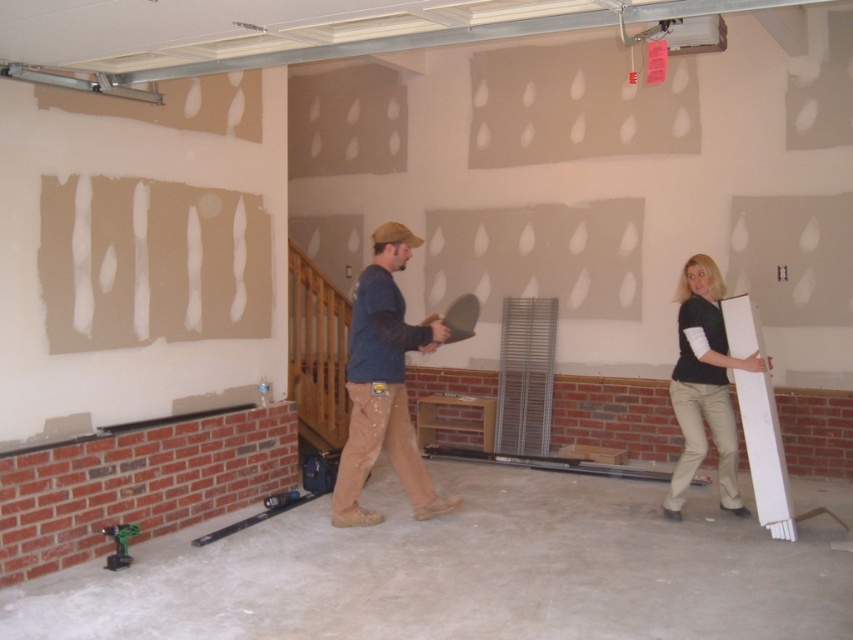
Question: Which point is farther from the camera taking this photo?

Choices:
 (A) (386, 280)
 (B) (717, 280)

Answer: (B)

Question: Is matte blue shirt at center further to the viewer compared to white matte board at center?

Choices:
 (A) no
 (B) yes

Answer: (A)

Question: Among these points, which one is farthest from the camera?

Choices:
 (A) (704, 369)
 (B) (403, 452)

Answer: (A)

Question: Does matte blue shirt at center appear on the left side of white matte board at center?

Choices:
 (A) yes
 (B) no

Answer: (A)

Question: Does matte blue shirt at center have a smaller size compared to white matte board at center?

Choices:
 (A) no
 (B) yes

Answer: (A)